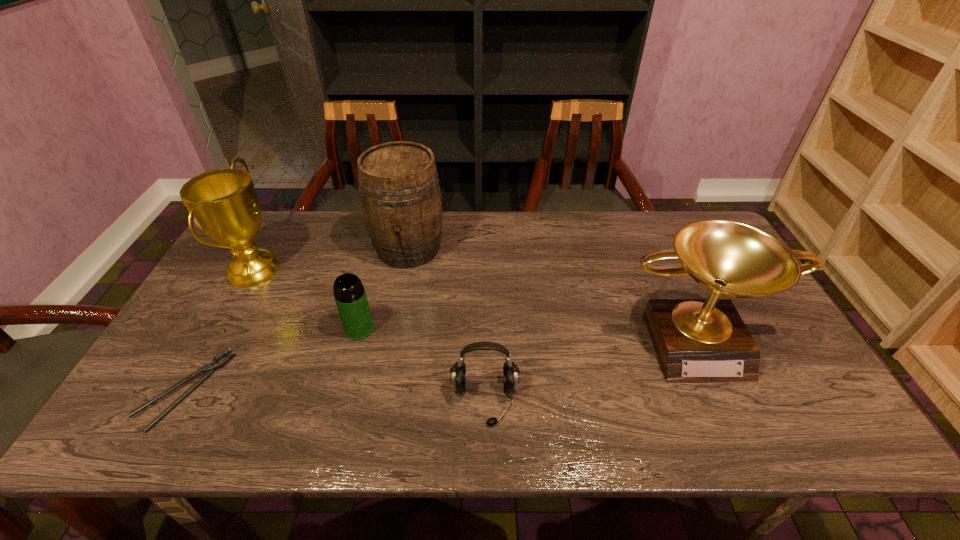
Locate an element on the screen. Image resolution: width=960 pixels, height=540 pixels. free point between the tongs and the right award is located at coordinates (440, 364).

In order to click on vacant space that's between the tongs and the cider in this screenshot , I will do `click(297, 319)`.

Image resolution: width=960 pixels, height=540 pixels. What are the coordinates of `free area in between the left award and the cider` in the screenshot? It's located at (331, 259).

Locate an element on the screen. This screenshot has height=540, width=960. vacant space that's between the tongs and the left award is located at coordinates (220, 329).

Locate an element on the screen. This screenshot has height=540, width=960. vacant space that is in between the cider and the left award is located at coordinates (331, 259).

Locate an element on the screen. object that is the third closest one to the cider is located at coordinates (511, 371).

Identify which object is the fourth nearest to the fourth tallest object. Please provide its 2D coordinates. Your answer should be formatted as a tuple, i.e. [(x, y)], where the tuple contains the x and y coordinates of a point satisfying the conditions above.

[(210, 368)]